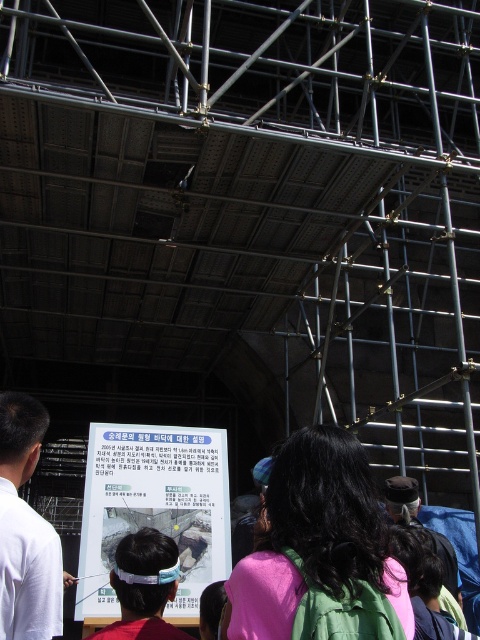
Question: Based on their relative distances, which object is farther from the white matte shirt at lower left?

Choices:
 (A) dark brown leather cap at center
 (B) light blue fabric headband at center
 (C) white paper at center

Answer: (A)

Question: Does white paper at center appear on the left side of light blue fabric headband at center?

Choices:
 (A) yes
 (B) no

Answer: (A)

Question: Which of the following is the farthest from the observer?

Choices:
 (A) white paper at center
 (B) light blue fabric headband at center
 (C) white matte shirt at lower left

Answer: (A)

Question: Does white paper at center have a greater width compared to dark brown leather cap at center?

Choices:
 (A) no
 (B) yes

Answer: (A)

Question: Which point is closer to the camera?

Choices:
 (A) (121, 584)
 (B) (171, 532)
 (C) (455, 564)

Answer: (A)

Question: Is white paper at center further to the viewer compared to light blue fabric headband at center?

Choices:
 (A) yes
 (B) no

Answer: (A)